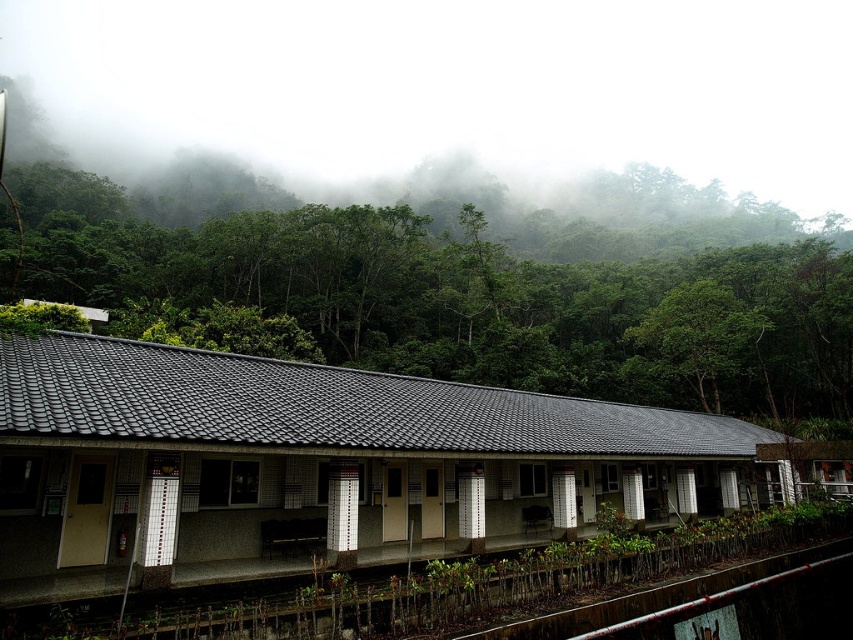
Question: Which point is farther to the camera?

Choices:
 (A) [308, 308]
 (B) [666, 298]

Answer: (A)

Question: Is white fog at upper center positioned behind green leafy tree at upper center?

Choices:
 (A) no
 (B) yes

Answer: (B)

Question: Can you confirm if white tile railway station at center is positioned below green leafy tree at center?

Choices:
 (A) yes
 (B) no

Answer: (A)

Question: Which point is farther to the camera?

Choices:
 (A) green leafy tree at upper center
 (B) metallic pipe at lower right

Answer: (A)

Question: Can you confirm if white tile railway station at center is positioned above green leafy tree at upper center?

Choices:
 (A) no
 (B) yes

Answer: (A)

Question: Which of the following is the closest to the observer?

Choices:
 (A) metallic pipe at lower right
 (B) white fog at upper center
 (C) white tile railway station at center

Answer: (C)